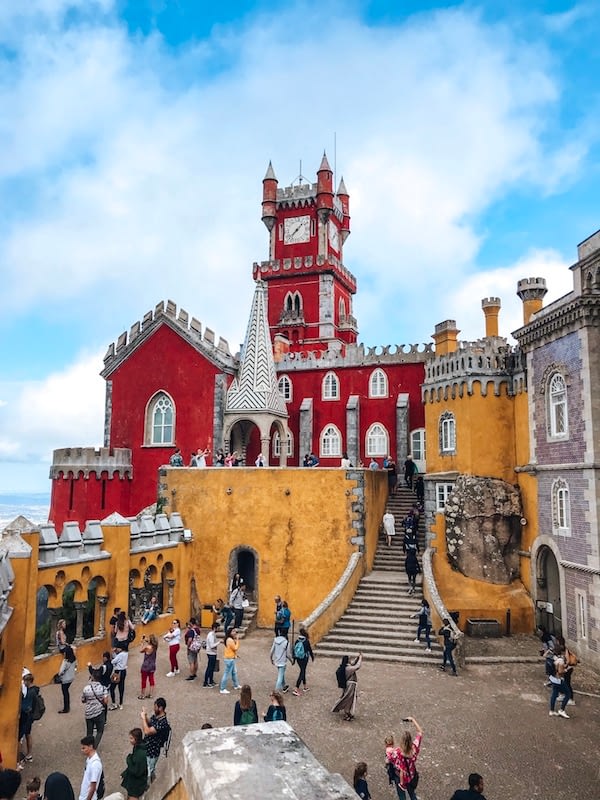
Locate an element on the screen. canopy is located at coordinates (275, 484), (251, 365).